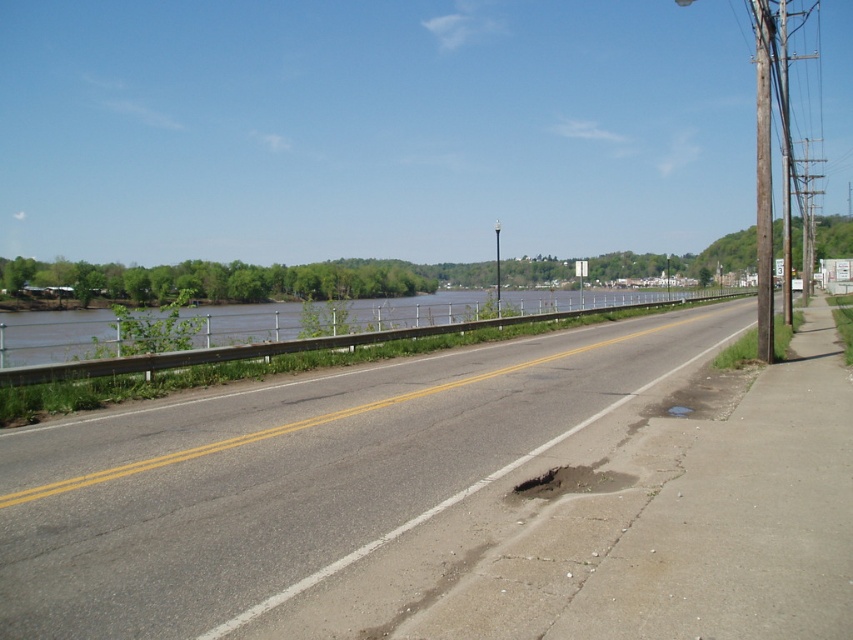
You are a delivery driver approaching the road shown in the image. You notice brown water at center on the road. Based on the scene description, where exactly is the brown water located in relation to the road and other objects?

The brown water at center is located at point coordinates of (x=292, y=346) on the road.

You are a pedestrian walking on the sidewalk and want to cross the road to reach the other side. The asphalt road at center has a pothole near the curb. Can you safely walk around the metallic pole at center to cross the road without stepping into the pothole?

The asphalt road at center is to the left of the metallic pole at center. To cross safely, you should walk around the metallic pole at center towards the right side of the road, away from the pothole near the curb on the left.